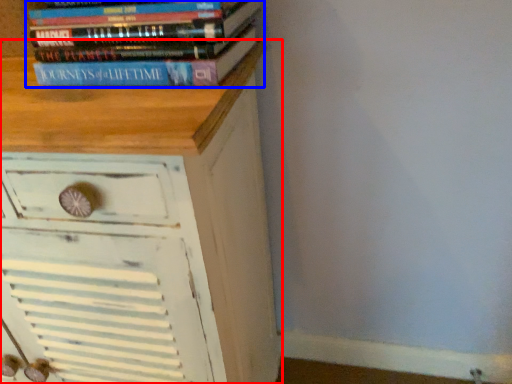
Question: Among these objects, which one is farthest to the camera, chest of drawers (highlighted by a red box) or book (highlighted by a blue box)?

Choices:
 (A) chest of drawers
 (B) book

Answer: (B)